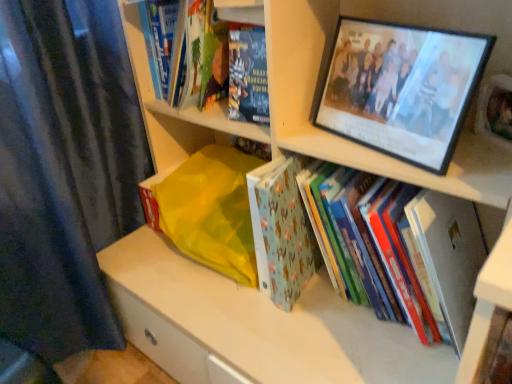
In order to face light blue fabric book at center, acting as the fourth book starting from the left, should I rotate leftwards or rightwards?

To face it directly, rotate right by 3.595 degrees.

What is the approximate width of light blue fabric book at center, positioned as the 2th book in right-to-left order?

light blue fabric book at center, positioned as the 2th book in right-to-left order, is 7.74 inches wide.

What are the coordinates of `hardcover book at upper left, the fourth book viewed from the right` in the screenshot? It's located at (214, 61).

The image size is (512, 384). What do you see at coordinates (447, 254) in the screenshot? I see `hardcover book at center, the 1th book from the right` at bounding box center [447, 254].

Locate an element on the screen. This screenshot has width=512, height=384. hardcover book at center, marked as the 5th book in a left-to-right arrangement is located at coordinates (447, 254).

Locate an element on the screen. hardcover book at upper center, acting as the 3th book starting from the right is located at coordinates (248, 74).

Is wooden photo frame at upper right facing towards hardcover book at upper left, the fourth book viewed from the right?

No, wooden photo frame at upper right is not aimed at hardcover book at upper left, the fourth book viewed from the right.

From a real-world perspective, is wooden photo frame at upper right located higher than hardcover book at upper left, placed as the second book when sorted from left to right?

No, from a real-world perspective, wooden photo frame at upper right is not on top of hardcover book at upper left, placed as the second book when sorted from left to right.

Is point (447, 162) positioned before point (168, 80)?

Yes, it is.

Is wooden photo frame at upper right to the left or to the right of hardcover book at upper left, the fourth book viewed from the right, in the image?

wooden photo frame at upper right is positioned on hardcover book at upper left, the fourth book viewed from the right,'s right side.

You are a GUI agent. You are given a task and a screenshot of the screen. Output one action in this format:
    pyautogui.click(x=<x>, y=<y>)
    Task: Click on the 3rd book behind the hardcover book at lower right, starting your count from the anchor
    The height and width of the screenshot is (384, 512).
    Given the screenshot: What is the action you would take?
    pyautogui.click(x=214, y=61)

Is hardcover book at lower right to the left of hardcover book at upper left, the fourth book viewed from the right, from the viewer's perspective?

No, hardcover book at lower right is not to the left of hardcover book at upper left, the fourth book viewed from the right.

From the image's perspective, is hardcover book at lower right beneath hardcover book at upper left, the fourth book viewed from the right?

Yes, from the image's perspective, hardcover book at lower right is beneath hardcover book at upper left, the fourth book viewed from the right.

Is the surface of hardcover book at lower right in direct contact with hardcover book at upper left, placed as the second book when sorted from left to right?

There is a gap between hardcover book at lower right and hardcover book at upper left, placed as the second book when sorted from left to right.

Who is smaller, hardcover book at center, marked as the 5th book in a left-to-right arrangement, or hardcover book at upper left, placed as the second book when sorted from left to right?

hardcover book at upper left, placed as the second book when sorted from left to right.

From the image's perspective, count 3rd books upward from the hardcover book at center, the 1th book from the right, and point to it. Please provide its 2D coordinates.

[(214, 61)]

Which object is thinner, hardcover book at center, marked as the 5th book in a left-to-right arrangement, or hardcover book at upper left, placed as the second book when sorted from left to right?

Thinner between the two is hardcover book at upper left, placed as the second book when sorted from left to right.

Is hardcover book at upper center, positioned as the third book in left-to-right order, to the left of wooden photo frame at upper right from the viewer's perspective?

Indeed, hardcover book at upper center, positioned as the third book in left-to-right order, is positioned on the left side of wooden photo frame at upper right.

Find the location of a particular element. the 4th book behind the wooden photo frame at upper right is located at coordinates (248, 74).

Is light blue fabric book at center, acting as the fourth book starting from the left, surrounding hardcover book at upper center, acting as the 3th book starting from the right?

No, hardcover book at upper center, acting as the 3th book starting from the right, is not inside light blue fabric book at center, acting as the fourth book starting from the left.

How much distance is there between light blue fabric book at center, acting as the fourth book starting from the left, and hardcover book at upper center, positioned as the third book in left-to-right order?

9.65 inches.

Is light blue fabric book at center, positioned as the 2th book in right-to-left order, further to the viewer compared to hardcover book at upper center, acting as the 3th book starting from the right?

No, light blue fabric book at center, positioned as the 2th book in right-to-left order, is closer to the viewer.

Is light blue fabric book at center, positioned as the 2th book in right-to-left order, directly adjacent to hardcover book at upper center, acting as the 3th book starting from the right?

No, light blue fabric book at center, positioned as the 2th book in right-to-left order, is not making contact with hardcover book at upper center, acting as the 3th book starting from the right.

Consider the image. Based on their sizes in the image, would you say wooden photo frame at upper right is bigger or smaller than light blue fabric book at center, positioned as the 2th book in right-to-left order?

Clearly, wooden photo frame at upper right is larger in size than light blue fabric book at center, positioned as the 2th book in right-to-left order.

Is wooden photo frame at upper right far from light blue fabric book at center, acting as the fourth book starting from the left?

No, wooden photo frame at upper right is not far from light blue fabric book at center, acting as the fourth book starting from the left.

From the image's perspective, is wooden photo frame at upper right above or below light blue fabric book at center, positioned as the 2th book in right-to-left order?

From the image's perspective, wooden photo frame at upper right appears above light blue fabric book at center, positioned as the 2th book in right-to-left order.

From a real-world perspective, is wooden photo frame at upper right positioned above or below light blue fabric book at center, acting as the fourth book starting from the left?

wooden photo frame at upper right is situated higher than light blue fabric book at center, acting as the fourth book starting from the left, in the real world.

Is hardcover book at upper center, positioned as the third book in left-to-right order, to the left or to the right of hardcover book at center, marked as the 5th book in a left-to-right arrangement, in the image?

From the image, it's evident that hardcover book at upper center, positioned as the third book in left-to-right order, is to the left of hardcover book at center, marked as the 5th book in a left-to-right arrangement.

Does hardcover book at upper center, positioned as the third book in left-to-right order, have a lesser height compared to hardcover book at center, the 1th book from the right?

Correct, hardcover book at upper center, positioned as the third book in left-to-right order, is not as tall as hardcover book at center, the 1th book from the right.

You are a GUI agent. You are given a task and a screenshot of the screen. Output one action in this format:
    pyautogui.click(x=<x>, y=<y>)
    Task: Click on the 3rd book behind when counting from the hardcover book at center, the 1th book from the right
    This screenshot has height=384, width=512.
    Given the screenshot: What is the action you would take?
    pyautogui.click(x=248, y=74)

From the image's perspective, does hardcover book at upper center, positioned as the third book in left-to-right order, appear lower than hardcover book at center, the 1th book from the right?

Actually, hardcover book at upper center, positioned as the third book in left-to-right order, appears above hardcover book at center, the 1th book from the right, in the image.

Where is `the 3rd book counting from the left of the wooden photo frame at upper right`? Image resolution: width=512 pixels, height=384 pixels. the 3rd book counting from the left of the wooden photo frame at upper right is located at coordinates (214, 61).

Find the location of `paperback book below the hardcover book at upper left, the fourth book viewed from the right (from the image's perspective)`. paperback book below the hardcover book at upper left, the fourth book viewed from the right (from the image's perspective) is located at coordinates (449, 255).

Considering their positions, is hardcover book at lower right positioned further to hardcover book at upper left, positioned as the fifth book in right-to-left order, than light blue fabric book at center, acting as the fourth book starting from the left?

The object further to hardcover book at upper left, positioned as the fifth book in right-to-left order, is hardcover book at lower right.

From the image, which object appears to be farther from hardcover book at upper left, which ranks as the first book in left-to-right order, hardcover book at lower right or wooden photo frame at upper right?

Among the two, hardcover book at lower right is located further to hardcover book at upper left, which ranks as the first book in left-to-right order.

Estimate the real-world distances between objects in this image. Which object is further from wooden photo frame at upper right, hardcover book at lower right or light blue fabric book at center, acting as the fourth book starting from the left?

The object further to wooden photo frame at upper right is light blue fabric book at center, acting as the fourth book starting from the left.

Based on their spatial positions, is hardcover book at upper center, acting as the 3th book starting from the right, or hardcover book at upper left, positioned as the fifth book in right-to-left order, further from hardcover book at center, the 1th book from the right?

The object further to hardcover book at center, the 1th book from the right, is hardcover book at upper left, positioned as the fifth book in right-to-left order.

Which object lies further to the anchor point hardcover book at upper left, positioned as the fifth book in right-to-left order, light blue fabric book at center, positioned as the 2th book in right-to-left order, or hardcover book at lower right?

hardcover book at lower right is further to hardcover book at upper left, positioned as the fifth book in right-to-left order.

Considering their positions, is hardcover book at upper left, placed as the second book when sorted from left to right, positioned closer to hardcover book at upper center, acting as the 3th book starting from the right, than light blue fabric book at center, positioned as the 2th book in right-to-left order?

hardcover book at upper left, placed as the second book when sorted from left to right, is closer to hardcover book at upper center, acting as the 3th book starting from the right.

When comparing their distances from hardcover book at upper center, positioned as the third book in left-to-right order, does hardcover book at upper left, positioned as the fifth book in right-to-left order, or hardcover book at center, marked as the 5th book in a left-to-right arrangement, seem further?

hardcover book at center, marked as the 5th book in a left-to-right arrangement.

When comparing their distances from hardcover book at upper left, which ranks as the first book in left-to-right order, does hardcover book at lower right or hardcover book at upper left, the fourth book viewed from the right, seem closer?

Among the two, hardcover book at upper left, the fourth book viewed from the right, is located nearer to hardcover book at upper left, which ranks as the first book in left-to-right order.

You are a GUI agent. You are given a task and a screenshot of the screen. Output one action in this format:
    pyautogui.click(x=<x>, y=<y>)
    Task: Click on the picture frame between hardcover book at upper left, placed as the second book when sorted from left to right, and light blue fabric book at center, positioned as the 2th book in right-to-left order, in the up-down direction
    This screenshot has width=512, height=384.
    Given the screenshot: What is the action you would take?
    pyautogui.click(x=402, y=88)

You are a GUI agent. You are given a task and a screenshot of the screen. Output one action in this format:
    pyautogui.click(x=<x>, y=<y>)
    Task: Click on the book that lies between wooden photo frame at upper right and hardcover book at center, marked as the 5th book in a left-to-right arrangement, from top to bottom
    Image resolution: width=512 pixels, height=384 pixels.
    Given the screenshot: What is the action you would take?
    pyautogui.click(x=281, y=230)

The image size is (512, 384). In order to click on picture frame between hardcover book at upper left, the fourth book viewed from the right, and hardcover book at lower right, in the horizontal direction in this screenshot , I will do `click(402, 88)`.

Identify the location of picture frame between hardcover book at upper left, positioned as the fifth book in right-to-left order, and hardcover book at lower right. This screenshot has width=512, height=384. (402, 88).